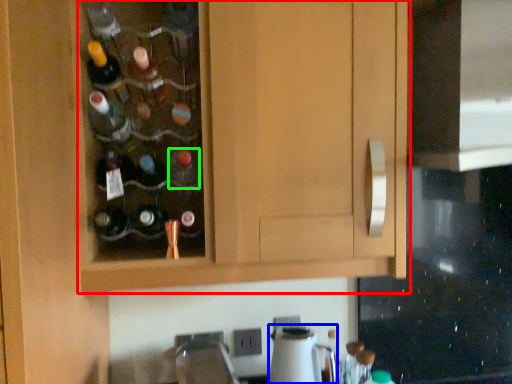
Question: Which object is the closest to the cabinetry (highlighted by a red box)? Choose among these: appliance (highlighted by a blue box) or bottle (highlighted by a green box).

Choices:
 (A) appliance
 (B) bottle

Answer: (B)